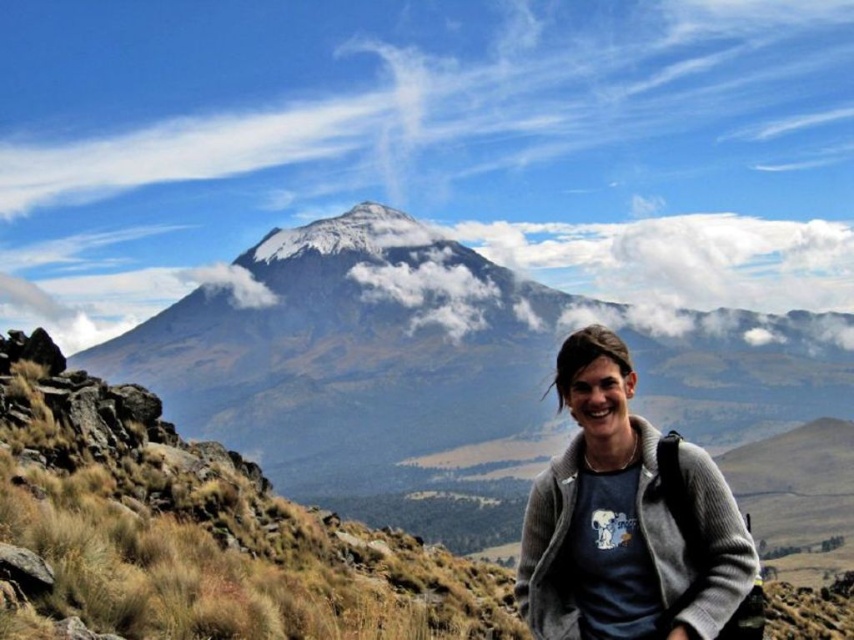
Is snowy rock mountain at center taller than gray woolen sweater at center?

Correct, snowy rock mountain at center is much taller as gray woolen sweater at center.

Between point (317, 275) and point (683, 625), which one is positioned in front?

Positioned in front is point (683, 625).

Between point (313, 477) and point (592, 381), which one is positioned behind?

The point (313, 477) is behind.

Image resolution: width=854 pixels, height=640 pixels. What are the coordinates of `snowy rock mountain at center` in the screenshot? It's located at (443, 371).